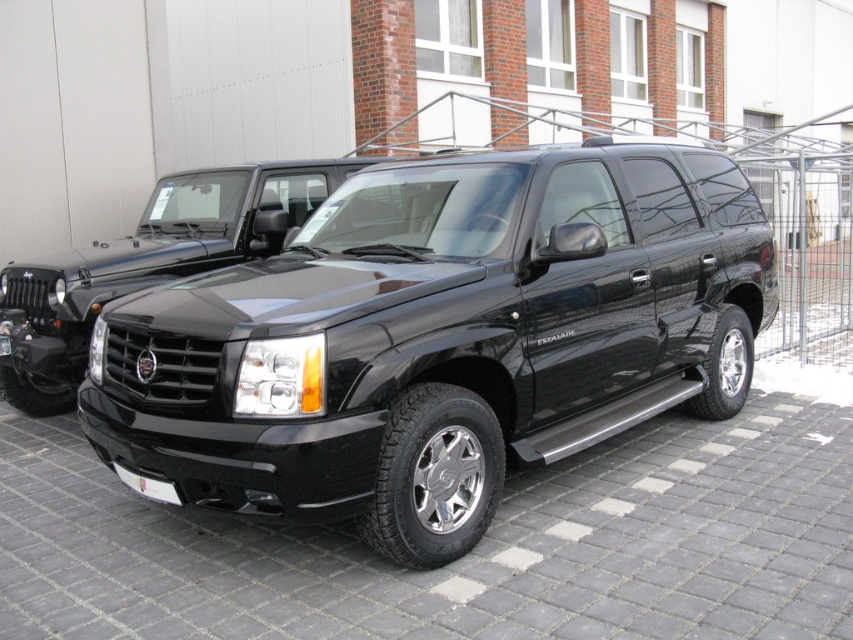
Is glossy black suv at center bigger than white plastic license plate at lower center?

Indeed, glossy black suv at center has a larger size compared to white plastic license plate at lower center.

What do you see at coordinates (440, 337) in the screenshot? The height and width of the screenshot is (640, 853). I see `glossy black suv at center` at bounding box center [440, 337].

At what (x,y) coordinates should I click in order to perform the action: click on glossy black suv at center. Please return your answer as a coordinate pair (x, y). Looking at the image, I should click on (440, 337).

Is white plastic license plate at lower center wider than white plastic license plate at center?

Yes, white plastic license plate at lower center is wider than white plastic license plate at center.

Does white plastic license plate at lower center appear under white plastic license plate at center?

Yes, white plastic license plate at lower center is below white plastic license plate at center.

What do you see at coordinates (148, 484) in the screenshot?
I see `white plastic license plate at lower center` at bounding box center [148, 484].

Locate an element on the screen. The width and height of the screenshot is (853, 640). white plastic license plate at lower center is located at coordinates (148, 484).

Which of these two, glossy black suv at center or white plastic license plate at center, stands shorter?

Standing shorter between the two is white plastic license plate at center.

Is glossy black suv at center positioned before white plastic license plate at center?

Yes, it is.

Who is more distant from viewer, (247, 266) or (1, 342)?

Point (1, 342)

The width and height of the screenshot is (853, 640). Find the location of `glossy black suv at center`. glossy black suv at center is located at coordinates (440, 337).